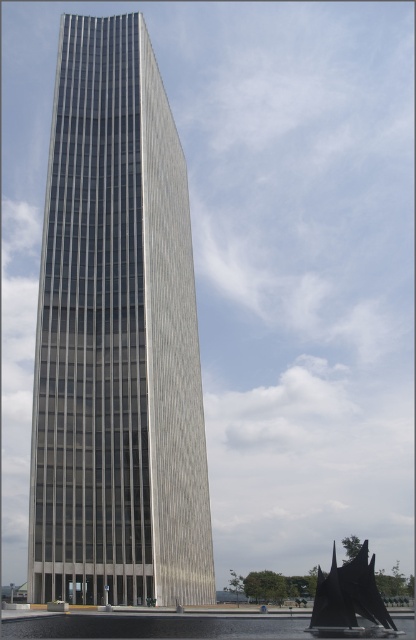
You are a photographer standing in front of the silver glass skyscraper at center and the black matte sailboat at lower right. You want to take a photo where both objects are visible without one blocking the other. Is this possible?

The black matte sailboat at lower right is behind the silver glass skyscraper at center, so it is blocked from view. Therefore, it is not possible to take a photo where both objects are visible without one blocking the other.

You are standing in front of the silver glass skyscraper at center and want to see the black matte sailboat at lower right. Is the sailboat visible from your current position?

The silver glass skyscraper at center is positioned over the black matte sailboat at lower right, so the sailboat might be partially or fully obscured by the skyscraper from your current viewpoint.

You are standing at the base of the skyscraper and want to take a photo of the black sculpture located at point (78, 584). If your camera has a maximum focus range of 50 meters, will you be able to capture the sculpture clearly?

The point (78, 584) is 51.32 meters from the camera, which exceeds the maximum focus range of 50 meters. Therefore, the camera will not be able to capture the sculpture clearly at this distance.